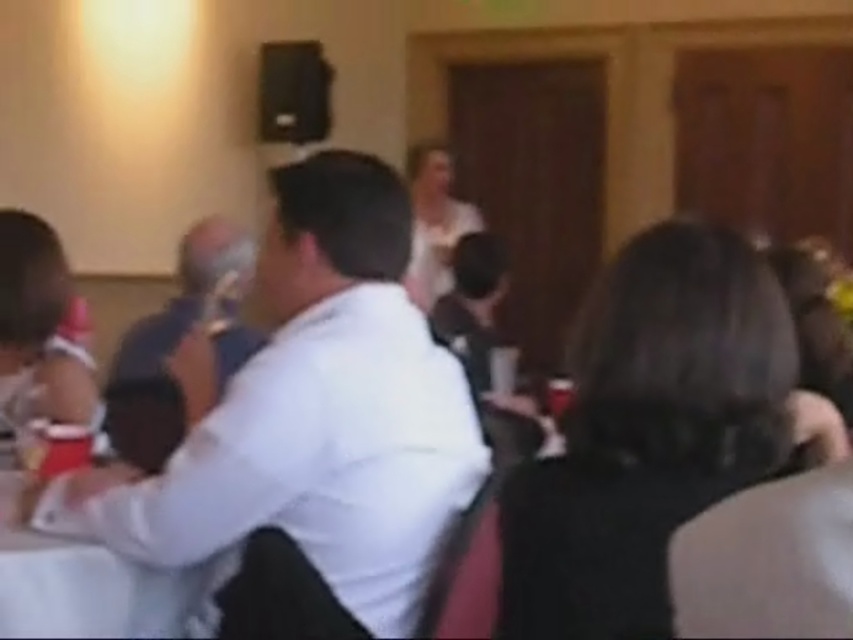
You are a photographer at the event and want to ensure both the black fabric hair at center and the white matte dress at center are clearly visible in your photo. Given their sizes, which one might require more careful framing to avoid being overshadowed?

The black fabric hair at center has a smaller size compared to the white matte dress at center, so it might require more careful framing to ensure it isn not overshadowed by the larger white matte dress at center.